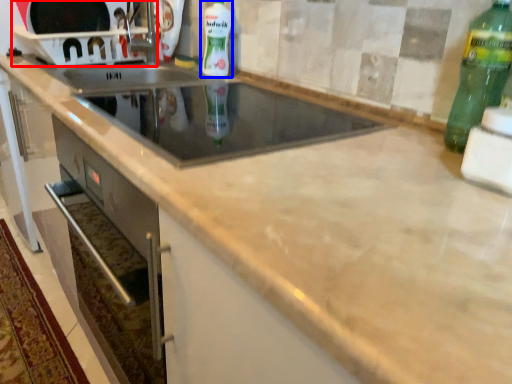
Question: Among these objects, which one is nearest to the camera, appliance (highlighted by a red box) or bottle (highlighted by a blue box)?

Choices:
 (A) appliance
 (B) bottle

Answer: (B)